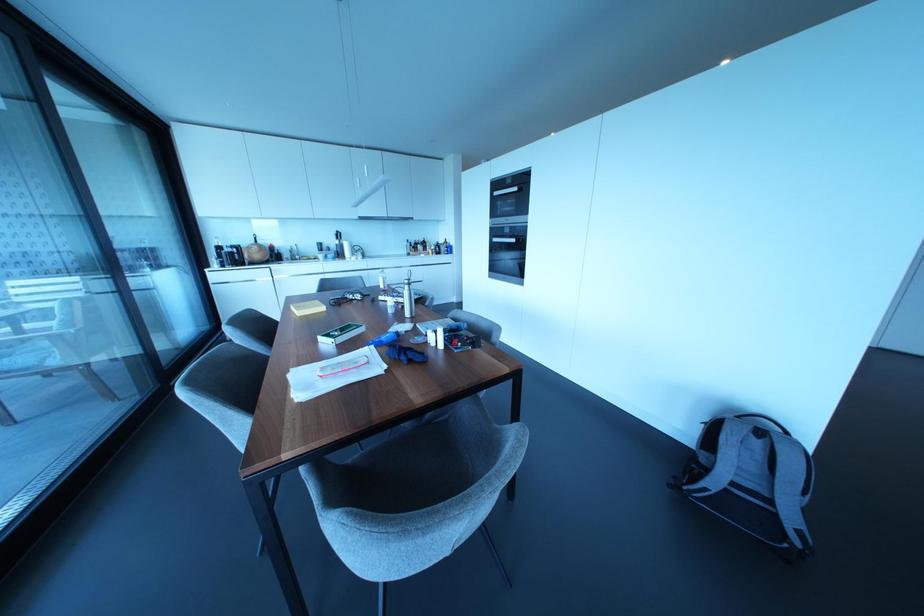
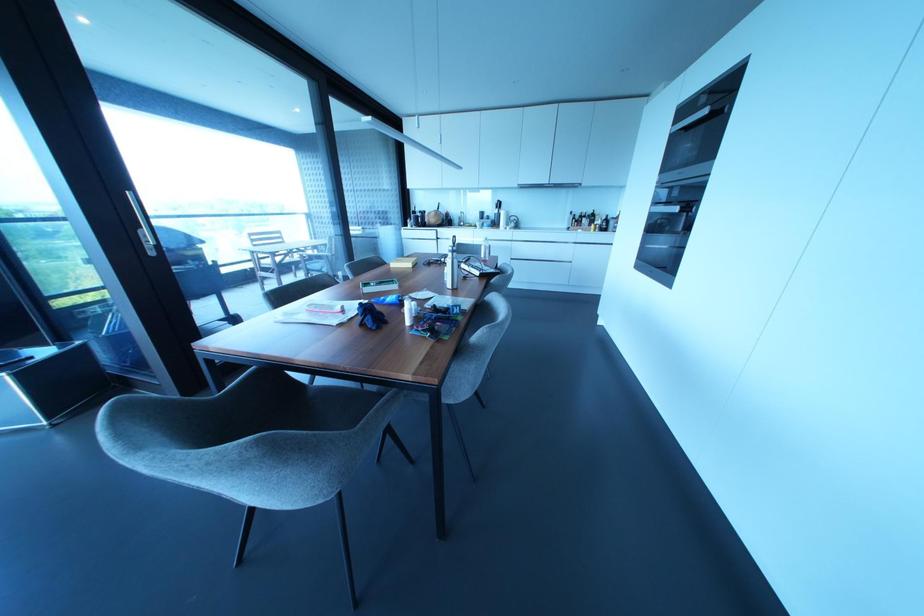
Question: Based on the continuous images, in which direction is the camera rotating? Reply with the corresponding letter.

Choices:
 (A) Left
 (B) Right
 (C) Up
 (D) Down

Answer: (A)